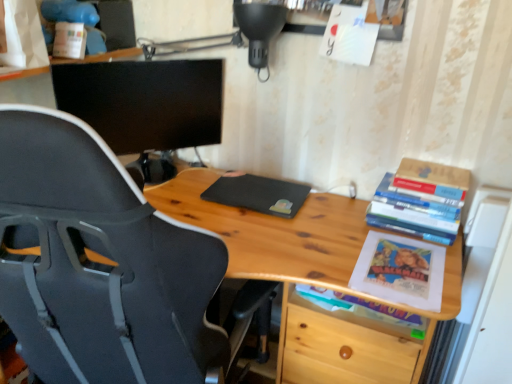
Where is `free space in front of black matte monitor at upper left`? The height and width of the screenshot is (384, 512). free space in front of black matte monitor at upper left is located at coordinates (178, 206).